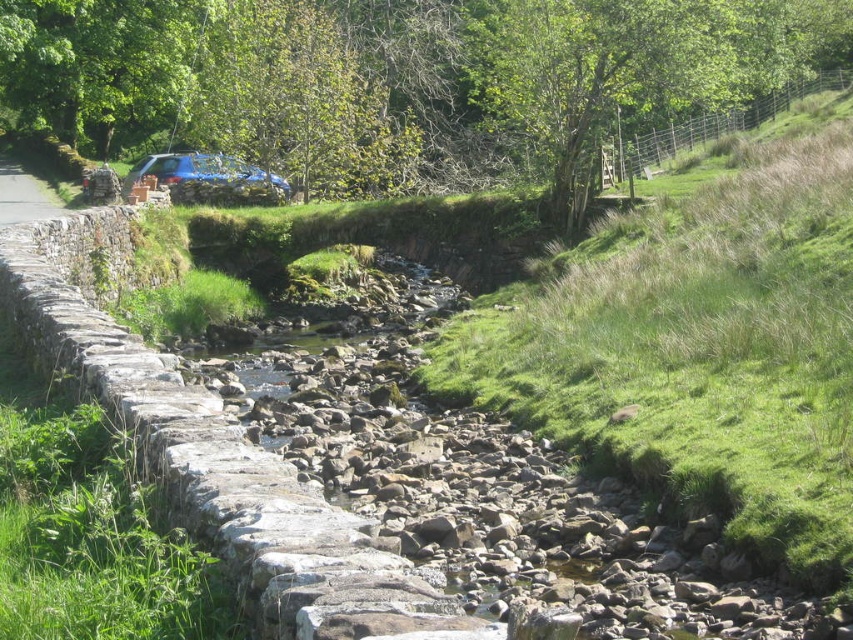
You are a pedestrian standing on the gray stone path at left and want to reach the blue metallic car at center. Which direction should you walk to get closer to the car?

Since the blue metallic car at center is further to the viewer than the gray stone path at left, you should walk towards the direction of the car, which is towards the front of the path to reach it.